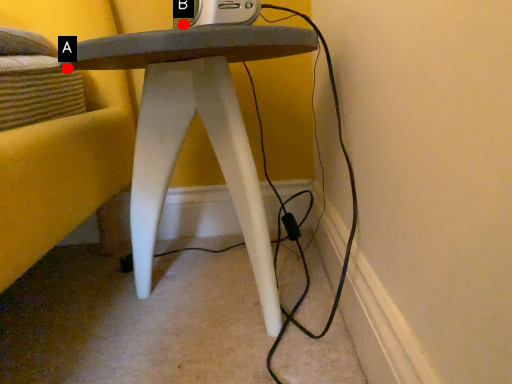
Question: Two points are circled on the image, labeled by A and B beside each circle. Which of the following is the farthest from the observer?

Choices:
 (A) A is further
 (B) B is further

Answer: (A)